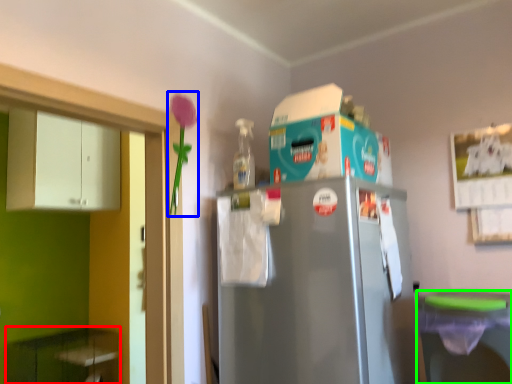
Question: Which object is positioned closest to cabinetry (highlighted by a red box)? Select from flower (highlighted by a blue box) and dish washer (highlighted by a green box).

Choices:
 (A) flower
 (B) dish washer

Answer: (A)